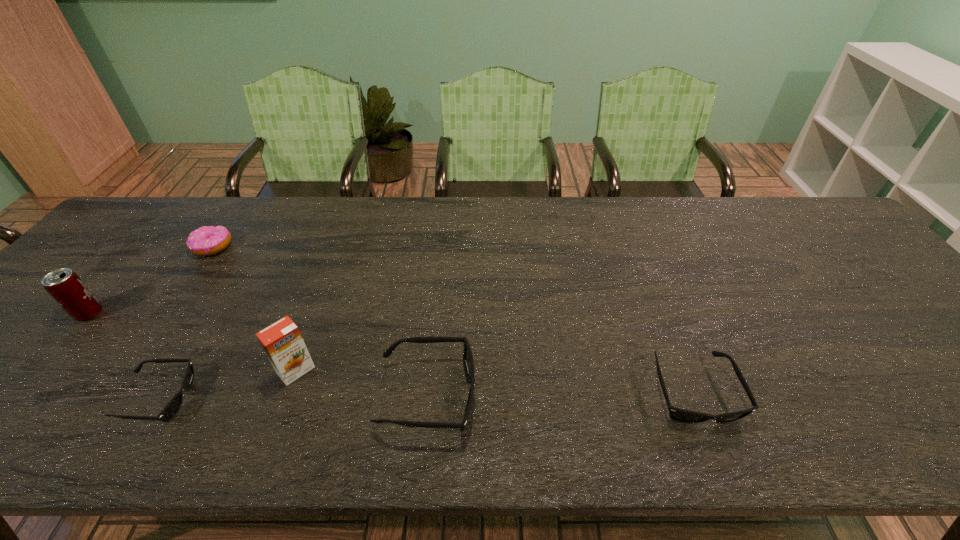
Identify the location of free space between the second shortest sunglasses and the farthest object. (453, 320).

Locate which object is the second closest to the second shortest sunglasses. Please provide its 2D coordinates. Your answer should be formatted as a tuple, i.e. [(x, y)], where the tuple contains the x and y coordinates of a point satisfying the conditions above.

[(282, 342)]

You are a GUI agent. You are given a task and a screenshot of the screen. Output one action in this format:
    pyautogui.click(x=<x>, y=<y>)
    Task: Click on the object that is the third nearest to the leftmost object
    The width and height of the screenshot is (960, 540).
    Given the screenshot: What is the action you would take?
    pyautogui.click(x=282, y=342)

Select which sunglasses is the closest to the second object from right to left. Please provide its 2D coordinates. Your answer should be formatted as a tuple, i.e. [(x, y)], where the tuple contains the x and y coordinates of a point satisfying the conditions above.

[(677, 414)]

What are the coordinates of `sunglasses that is the second closest to the fourth shortest object` in the screenshot? It's located at (171, 409).

At what (x,y) coordinates should I click in order to perform the action: click on vacant space that satisfies the following two spatial constraints: 1. on the front-facing side of the second tallest sunglasses; 2. on the front-facing side of the leftmost sunglasses. Please return your answer as a coordinate pair (x, y). Image resolution: width=960 pixels, height=540 pixels. Looking at the image, I should click on (696, 399).

Identify the location of free space in the image that satisfies the following two spatial constraints: 1. on the front-facing side of the second shortest sunglasses; 2. on the front-facing side of the tallest sunglasses. (694, 395).

What are the coordinates of `free space that satisfies the following two spatial constraints: 1. on the front-facing side of the second shortest sunglasses; 2. on the front-facing side of the shortest sunglasses` in the screenshot? It's located at (696, 399).